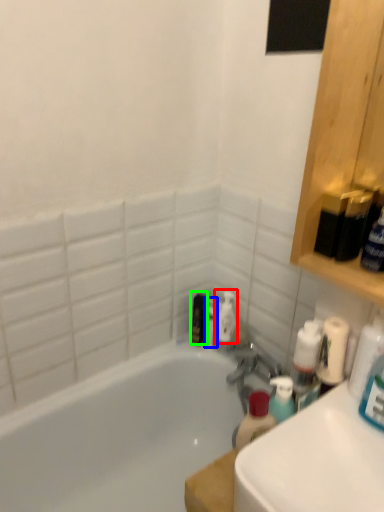
Question: Estimate the real-world distances between objects in this image. Which object is closer to cleaning product (highlighted by a red box), toiletry (highlighted by a blue box) or toiletry (highlighted by a green box)?

Choices:
 (A) toiletry
 (B) toiletry

Answer: (A)